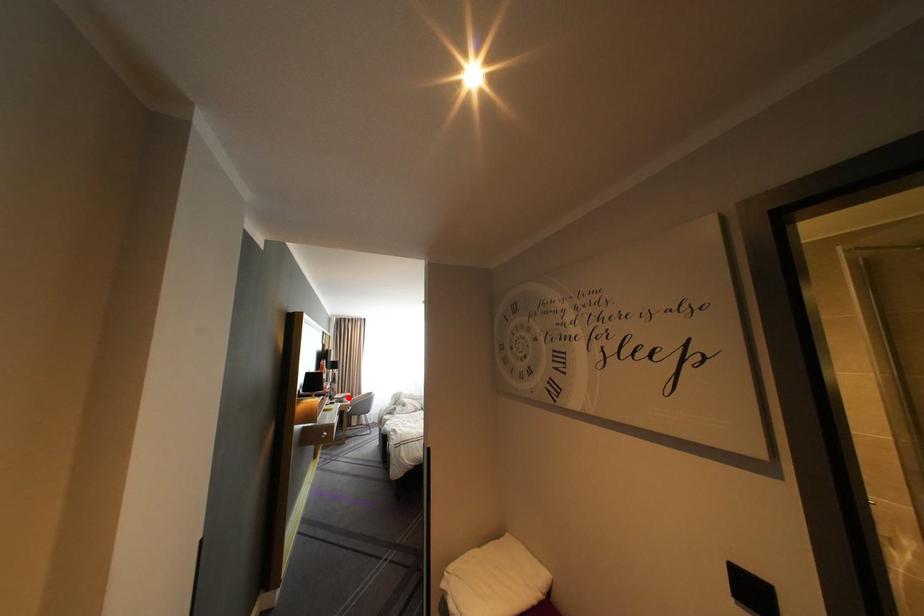
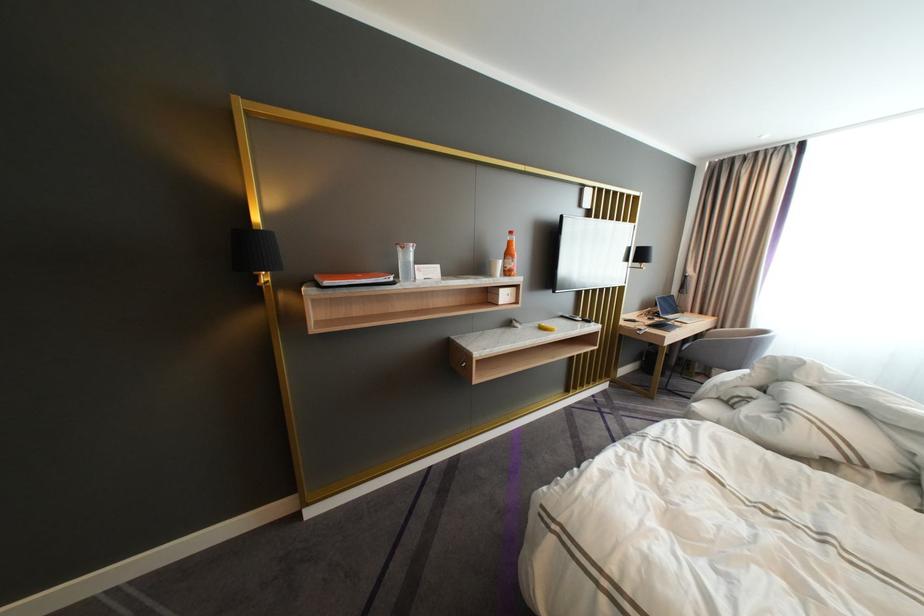
Question: I am providing you with two images of the same scene from different viewpoints. A red point is marked on the first image. At the location where the point appears in image 1, is it still visible in image 2?

Choices:
 (A) Yes
 (B) No

Answer: (A)